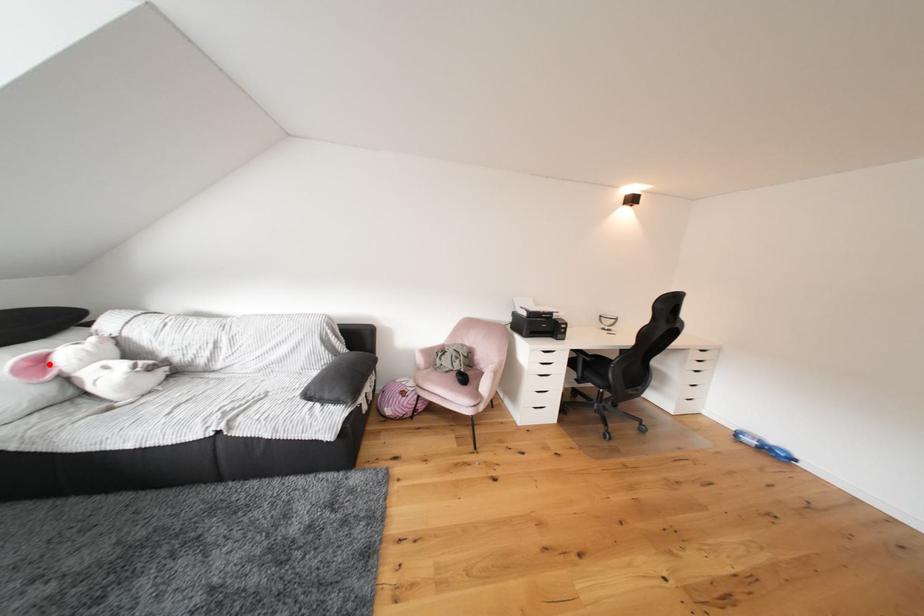
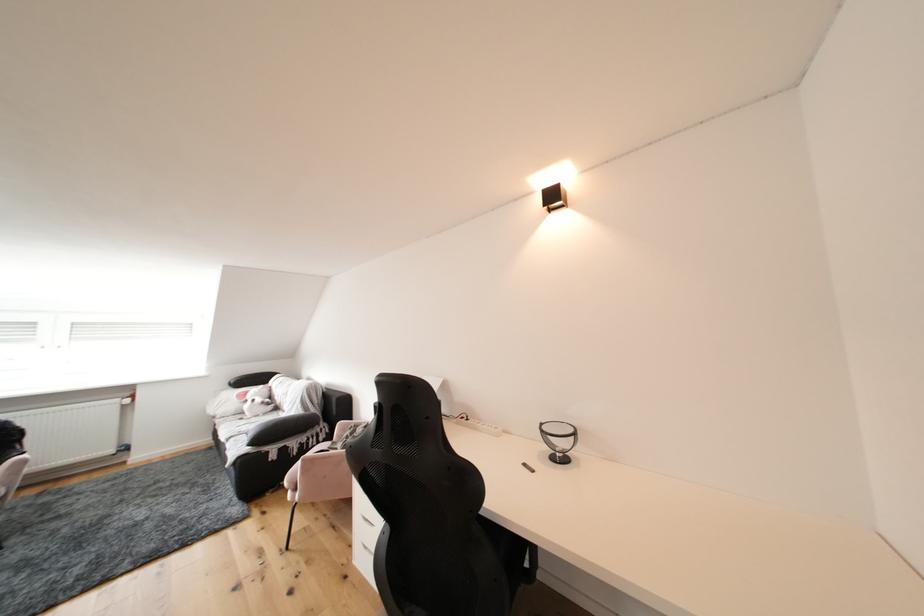
The point at the highlighted location is marked in the first image. Where is the corresponding point in the second image?

(256, 397)